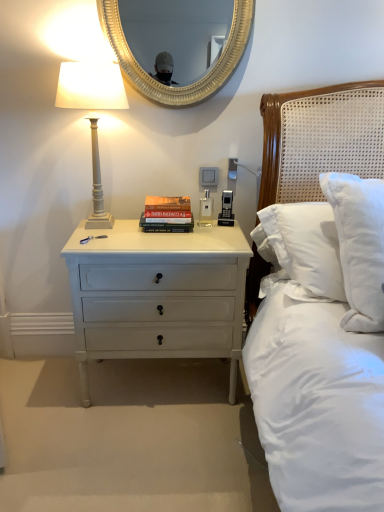
Image resolution: width=384 pixels, height=512 pixels. In order to click on free space on the front side of hardcover book at center in this screenshot , I will do `click(171, 239)`.